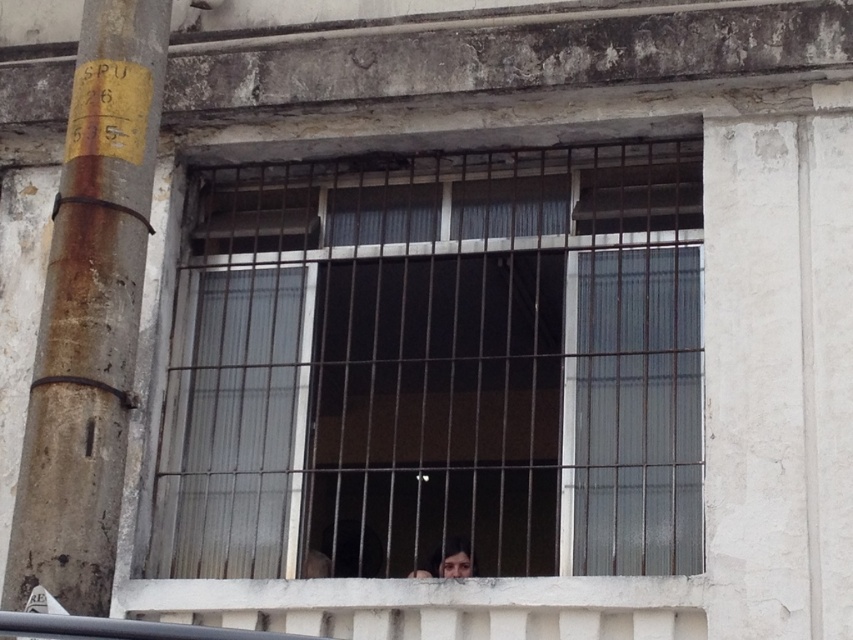
You are a painter hired to measure objects in the scene. The rusty metal pole at left is wider than the smooth skin face at center. Which object should you paint first if you need to paint the wider object first?

You should paint the rusty metal pole at left first because its width surpasses the smooth skin face at center.

You are standing in front of a building with a clear glass window at center. The window is located at coordinates 0.573, 0.513. If you want to find the window, where should you look?

The clear glass window at center is located at the 2D coordinates point [437,365].

You are a drone operator trying to capture a photo of the window with metal bars. You have two points marked on your screen at coordinates point (39, 470) and point (463, 554). Which point is closer to the camera to ensure better focus?

Point (39, 470) is closer to the camera than point (463, 554), so focusing on it will ensure better clarity in the photo.